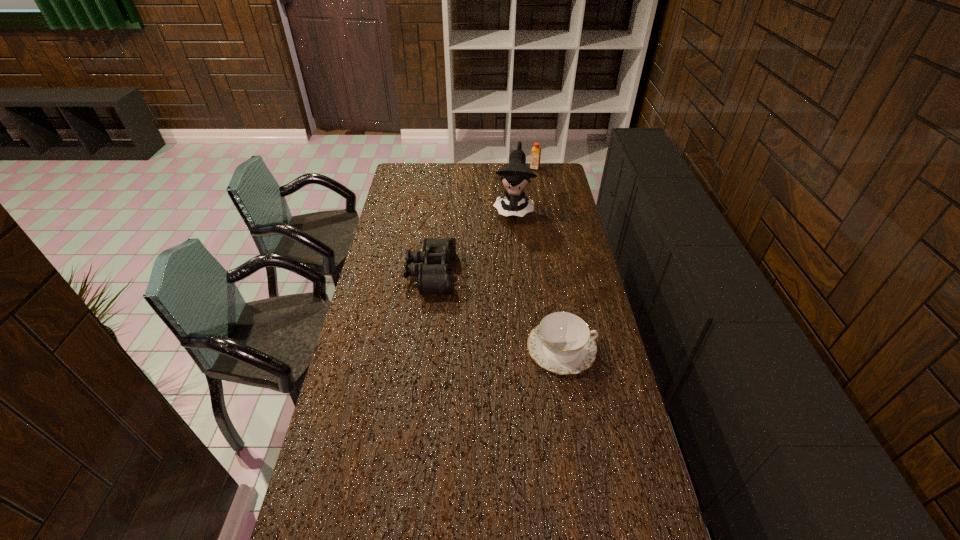
In the image, there is a desktop. At what (x,y) coordinates should I click in order to perform the action: click on free region at the far edge. Please return your answer as a coordinate pair (x, y). Image resolution: width=960 pixels, height=540 pixels. Looking at the image, I should click on (491, 175).

Find the location of `vacant region at the near edge`. vacant region at the near edge is located at coordinates (489, 507).

The image size is (960, 540). In the image, there is a desktop. Find the location of `vacant space at the left edge`. vacant space at the left edge is located at coordinates (413, 204).

Image resolution: width=960 pixels, height=540 pixels. Find the location of `vacant space at the right edge`. vacant space at the right edge is located at coordinates (602, 403).

Find the location of `vacant space at the far right corner`. vacant space at the far right corner is located at coordinates (544, 166).

Image resolution: width=960 pixels, height=540 pixels. I want to click on free space between the doll and the chinaware, so click(x=538, y=278).

The image size is (960, 540). I want to click on empty location between the third shortest object and the nearest object, so click(x=548, y=258).

Find the location of `free point between the chinaware and the orange juice`. free point between the chinaware and the orange juice is located at coordinates (548, 258).

Image resolution: width=960 pixels, height=540 pixels. In order to click on vacant region between the doll and the shortest object in this screenshot , I will do `click(538, 278)`.

Identify the location of free space between the shortest object and the second shortest object. The height and width of the screenshot is (540, 960). (496, 311).